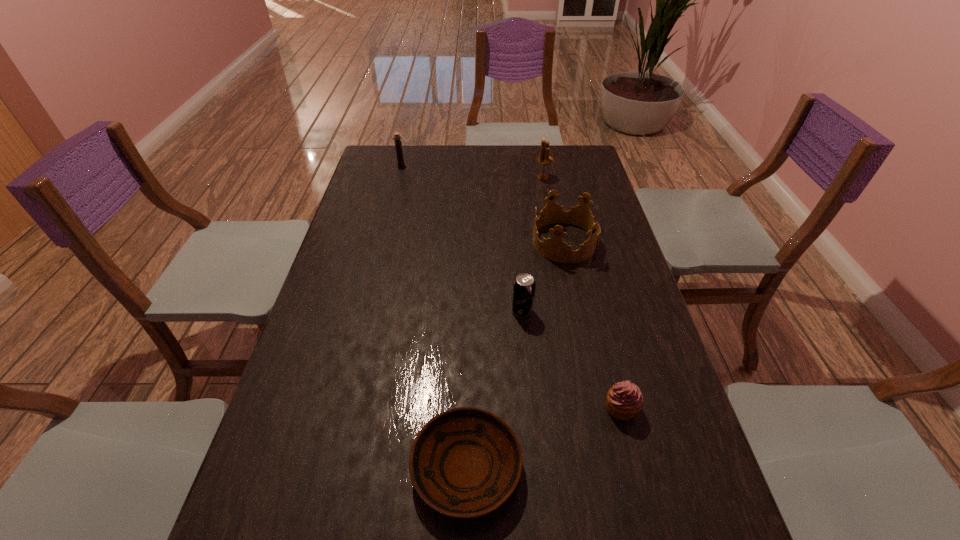
Locate an element on the screen. This screenshot has height=540, width=960. cupcake located at the right edge is located at coordinates (624, 400).

This screenshot has height=540, width=960. In order to click on object positioned at the far left corner in this screenshot , I will do `click(398, 144)`.

Where is `blank space at the far edge of the desktop`? The height and width of the screenshot is (540, 960). blank space at the far edge of the desktop is located at coordinates (416, 167).

Identify the location of blank space at the left edge of the desktop. This screenshot has width=960, height=540. (273, 494).

The image size is (960, 540). What are the coordinates of `free space at the right edge` in the screenshot? It's located at (660, 463).

The height and width of the screenshot is (540, 960). I want to click on free location at the far left corner, so click(x=398, y=176).

In the image, there is a desktop. At what (x,y) coordinates should I click in order to perform the action: click on vacant space at the far right corner. Please return your answer as a coordinate pair (x, y). The height and width of the screenshot is (540, 960). Looking at the image, I should click on (588, 146).

I want to click on vacant area that lies between the cupcake and the fifth nearest object, so click(x=582, y=293).

You are a GUI agent. You are given a task and a screenshot of the screen. Output one action in this format:
    pyautogui.click(x=<x>, y=<y>)
    Task: Click on the free space between the fifth tallest object and the farthest object
    
    Given the screenshot: What is the action you would take?
    pyautogui.click(x=511, y=287)

Find the location of `empty space between the third object from left to right and the leftmost object`. empty space between the third object from left to right and the leftmost object is located at coordinates (462, 238).